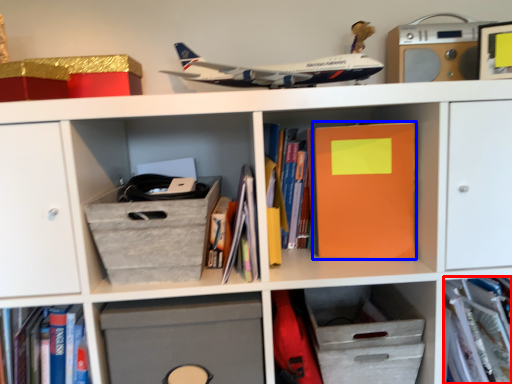
Question: Which object appears closest to the camera in this image, book (highlighted by a red box) or paperback book (highlighted by a blue box)?

Choices:
 (A) book
 (B) paperback book

Answer: (B)